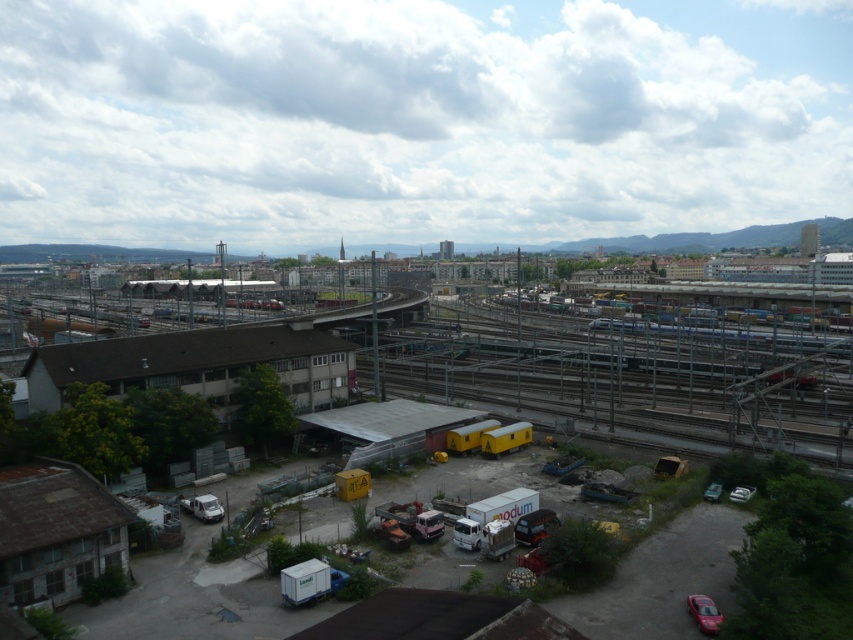
Question: Is yellow matte train cars at center further to the viewer compared to metallic silver car at lower right?

Choices:
 (A) yes
 (B) no

Answer: (B)

Question: Considering the relative positions of yellow matte train cars at center and metallic silver car at lower right in the image provided, where is yellow matte train cars at center located with respect to metallic silver car at lower right?

Choices:
 (A) above
 (B) below

Answer: (B)

Question: Is shiny red car at bottom right thinner than metallic silver car at lower right?

Choices:
 (A) no
 (B) yes

Answer: (A)

Question: Which point is closer to the camera?

Choices:
 (A) yellow matte train cars at center
 (B) metallic silver car at lower right

Answer: (A)

Question: Among these objects, which one is nearest to the camera?

Choices:
 (A) shiny red car at bottom right
 (B) metallic silver car at lower right

Answer: (A)

Question: Based on their relative distances, which object is farther from the shiny red car at bottom right?

Choices:
 (A) yellow matte train cars at center
 (B) metallic silver car at lower right

Answer: (B)